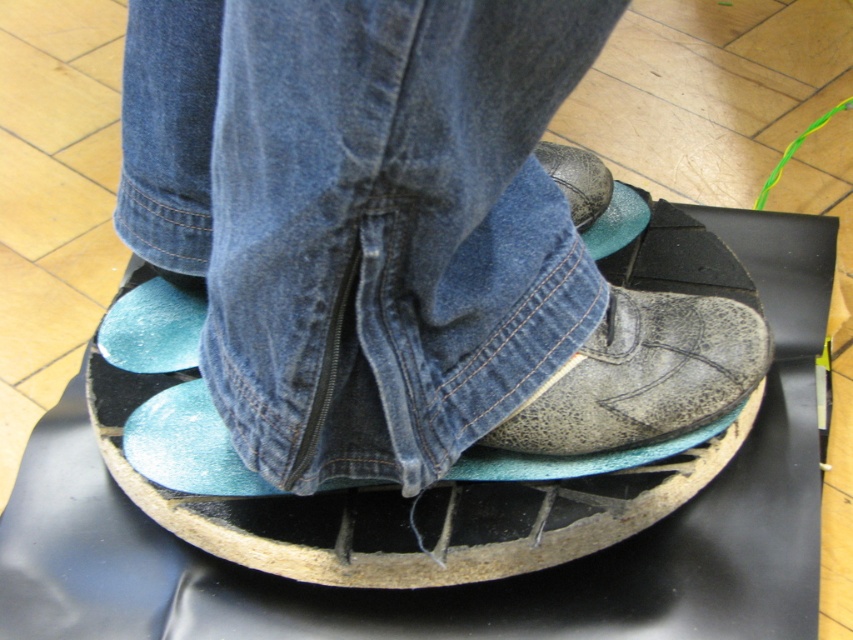
Find the location of a particular element. worn leather shoe at center is located at coordinates (643, 376).

Based on the photo, who is higher up, worn leather shoe at center or leather shoe at center?

leather shoe at center is higher up.

Where is `worn leather shoe at center`? worn leather shoe at center is located at coordinates (643, 376).

Image resolution: width=853 pixels, height=640 pixels. In order to click on worn leather shoe at center in this screenshot , I will do `click(643, 376)`.

Find the location of a particular element. This screenshot has height=640, width=853. worn leather shoe at center is located at coordinates (643, 376).

Does worn leather shoe at center have a smaller size compared to teal suede shoe at center?

Incorrect, worn leather shoe at center is not smaller in size than teal suede shoe at center.

Who is more forward, (515, 424) or (155, 292)?

Point (515, 424)

Locate an element on the screen. The width and height of the screenshot is (853, 640). worn leather shoe at center is located at coordinates (643, 376).

Does distressed leather shoe at center appear on the left side of worn leather shoe at center?

Correct, you'll find distressed leather shoe at center to the left of worn leather shoe at center.

Where is `distressed leather shoe at center`? This screenshot has width=853, height=640. distressed leather shoe at center is located at coordinates tap(399, 237).

The image size is (853, 640). Find the location of `distressed leather shoe at center`. distressed leather shoe at center is located at coordinates (399, 237).